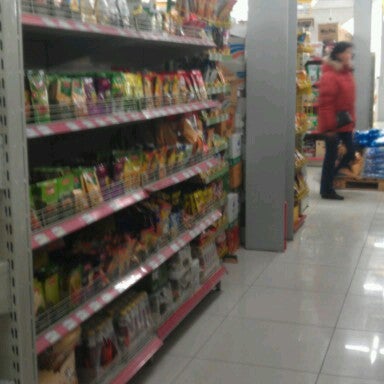
Find the location of a particular element. flooring is located at coordinates (308, 300).